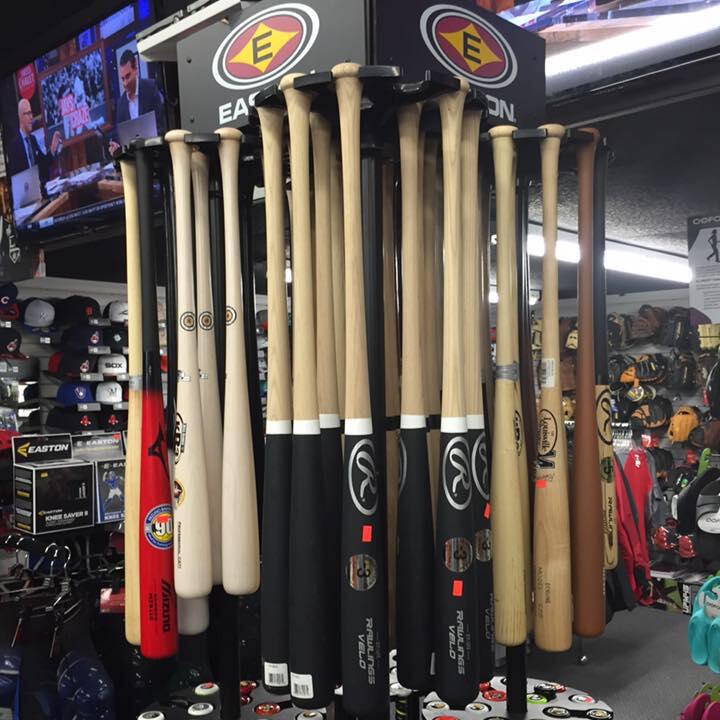
Where is `television`? television is located at coordinates (65, 106).